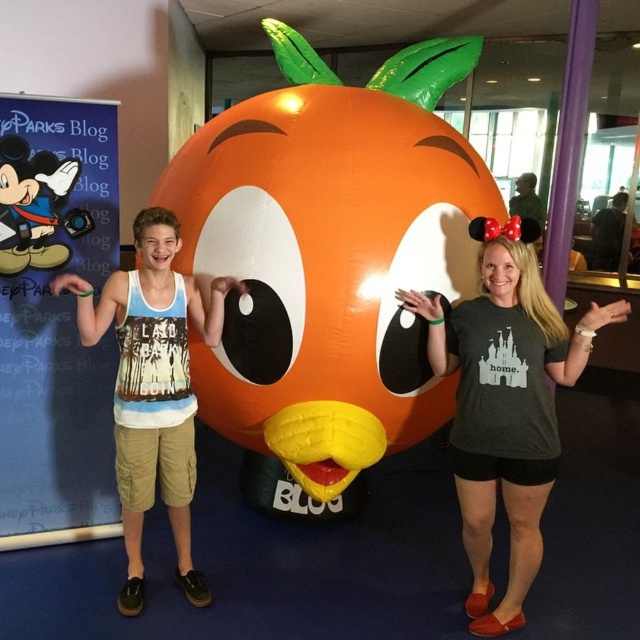
You are a photographer trying to capture a clear shot of both the inflatable orange at center and the brushed metal mickey mouse poster at left. Since you want both to be visible in the frame, which object should you focus on first to ensure proper focus, considering their sizes?

The inflatable orange at center is bigger than the brushed metal mickey mouse poster at left. To ensure both are in focus, you should focus on the inflatable orange at center first, as it is larger and requires more precise focus to capture details clearly.

You are standing in the lobby and want to take a photo of the orange inflatable character with the Mickey Mouse banner in the background. To ensure both are visible, which point should you stand closer to? The point at (218, 122) or the point at (38, 188)?

You should stand closer to point (38, 188) because point (218, 122) is behind it, so standing closer to the front point allows both subjects to be visible in the frame.